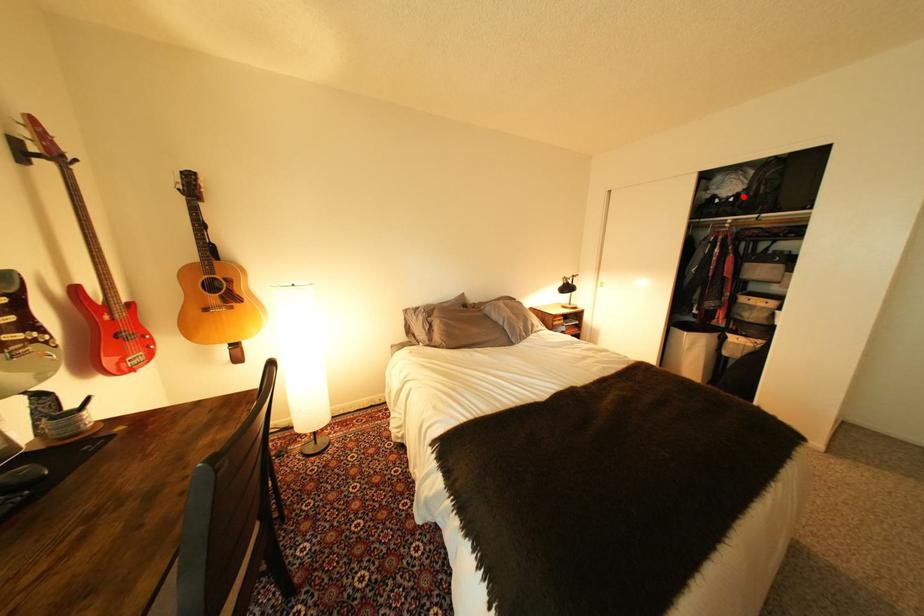
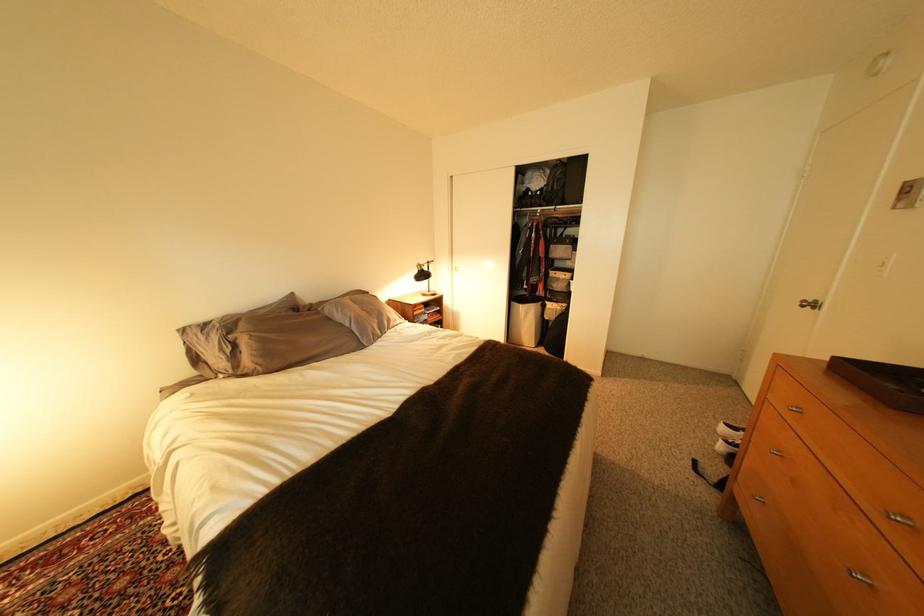
Question: I am providing you with two images of the same scene from different viewpoints. In image1, a red point is highlighted. Considering the same 3D point in image2, which of the following is correct?

Choices:
 (A) It is closer
 (B) It is farther

Answer: (A)